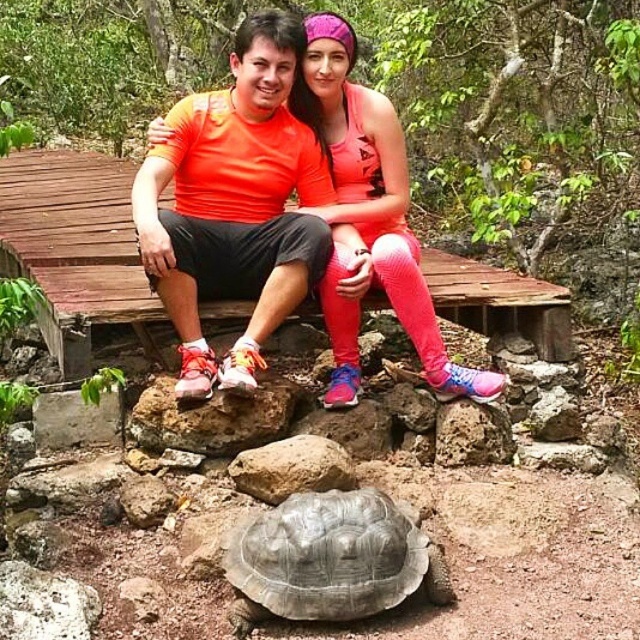
Question: Can you confirm if orange matte shirt at center is thinner than gray textured tortoise at lower center?

Choices:
 (A) no
 (B) yes

Answer: (A)

Question: Does orange matte shirt at center have a larger size compared to gray textured tortoise at lower center?

Choices:
 (A) no
 (B) yes

Answer: (B)

Question: Can you confirm if orange matte shirt at center is positioned to the left of gray textured tortoise at lower center?

Choices:
 (A) yes
 (B) no

Answer: (B)

Question: Among these objects, which one is farthest from the camera?

Choices:
 (A) orange matte shirt at center
 (B) gray textured tortoise at lower center

Answer: (A)

Question: Which of the following is the farthest from the observer?

Choices:
 (A) gray textured tortoise at lower center
 (B) orange matte shirt at center

Answer: (B)